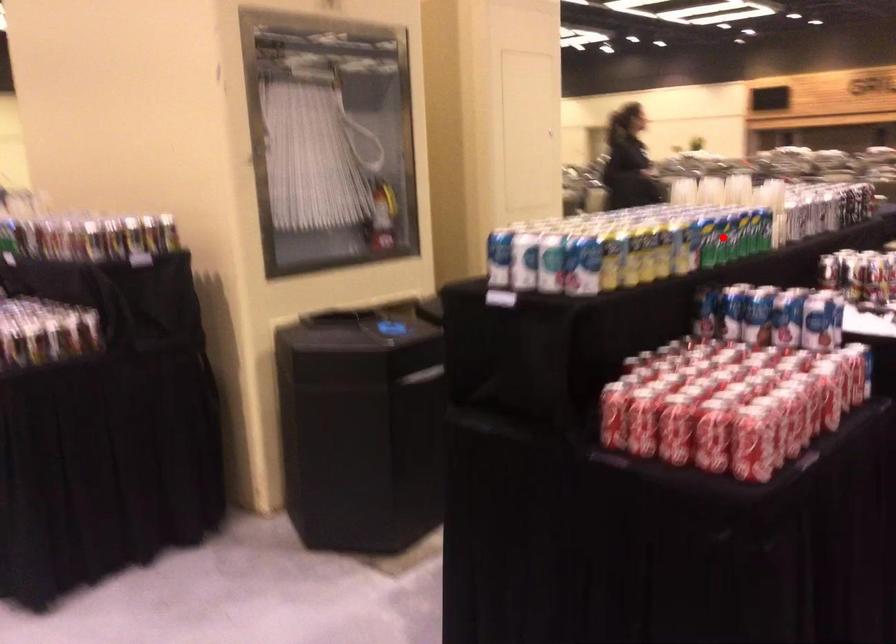
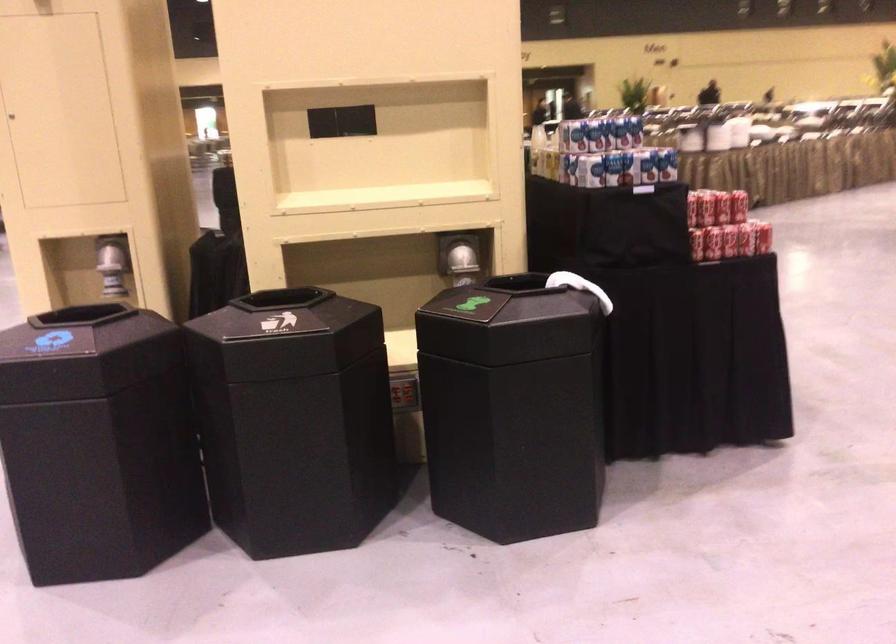
Question: I am providing you with two images of the same scene from different viewpoints. A red point is marked on the first image. At the location where the point appears in image 1, is it still visible in image 2?

Choices:
 (A) Yes
 (B) No

Answer: (B)